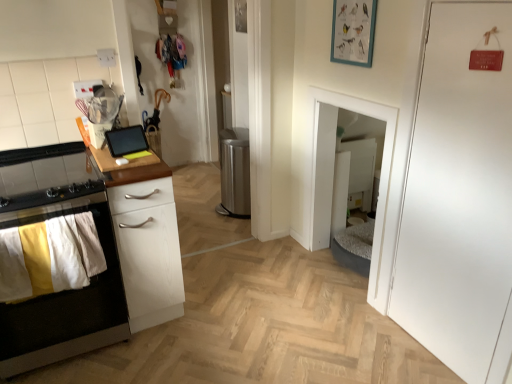
Locate an element on the screen. vacant space in between white matte door at right and white wood chest of drawers at left is located at coordinates (288, 326).